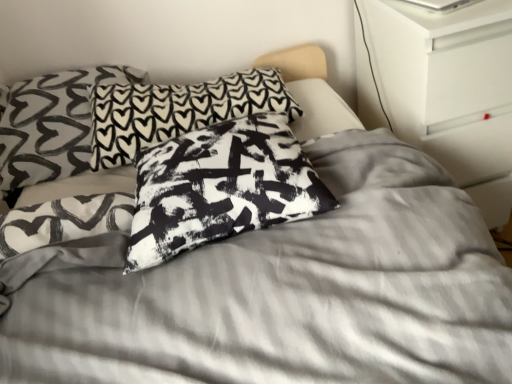
Question: Which direction should I rotate to look at black and white printed pillow at center, positioned as the 2th pillow in back-to-front order, — up or down?

Choices:
 (A) down
 (B) up

Answer: (B)

Question: From the image's perspective, is white glossy dresser at upper right on black-and-white printed pillow at center, the 1th pillow positioned from the front?

Choices:
 (A) no
 (B) yes

Answer: (B)

Question: Is white glossy dresser at upper right shorter than black-and-white printed pillow at center, the third pillow in the back-to-front sequence?

Choices:
 (A) yes
 (B) no

Answer: (B)

Question: From a real-world perspective, is white glossy dresser at upper right positioned under black-and-white printed pillow at center, the 1th pillow positioned from the front, based on gravity?

Choices:
 (A) yes
 (B) no

Answer: (A)

Question: Does white glossy dresser at upper right have a lesser width compared to black-and-white printed pillow at center, the 1th pillow positioned from the front?

Choices:
 (A) no
 (B) yes

Answer: (A)

Question: Is white glossy dresser at upper right positioned with its back to black-and-white printed pillow at center, the 1th pillow positioned from the front?

Choices:
 (A) yes
 (B) no

Answer: (B)

Question: Is white glossy dresser at upper right at the right side of black-and-white printed pillow at center, the third pillow in the back-to-front sequence?

Choices:
 (A) no
 (B) yes

Answer: (B)

Question: Is the depth of black printed pillow at center, placed as the 3th pillow when sorted from front to back, less than that of black and white printed pillow at center, acting as the second pillow starting from the front?

Choices:
 (A) no
 (B) yes

Answer: (A)

Question: Is black printed pillow at center, which is counted as the 1th pillow, starting from the back, bigger than black and white printed pillow at center, acting as the second pillow starting from the front?

Choices:
 (A) no
 (B) yes

Answer: (A)

Question: Considering the relative positions of black printed pillow at center, which is counted as the 1th pillow, starting from the back, and black and white printed pillow at center, acting as the second pillow starting from the front, in the image provided, is black printed pillow at center, which is counted as the 1th pillow, starting from the back, behind black and white printed pillow at center, acting as the second pillow starting from the front,?

Choices:
 (A) no
 (B) yes

Answer: (B)

Question: From a real-world perspective, is black printed pillow at center, placed as the 3th pillow when sorted from front to back, below black and white printed pillow at center, acting as the second pillow starting from the front?

Choices:
 (A) yes
 (B) no

Answer: (A)

Question: Considering the relative sizes of black printed pillow at center, placed as the 3th pillow when sorted from front to back, and black and white printed pillow at center, acting as the second pillow starting from the front, in the image provided, is black printed pillow at center, placed as the 3th pillow when sorted from front to back, shorter than black and white printed pillow at center, acting as the second pillow starting from the front,?

Choices:
 (A) yes
 (B) no

Answer: (A)

Question: Is black printed pillow at center, placed as the 3th pillow when sorted from front to back, taller than black and white printed pillow at center, positioned as the 2th pillow in back-to-front order?

Choices:
 (A) no
 (B) yes

Answer: (A)

Question: Considering the relative positions of black-and-white printed pillow at center, the 1th pillow positioned from the front, and black printed pillow at center, which is counted as the 1th pillow, starting from the back, in the image provided, is black-and-white printed pillow at center, the 1th pillow positioned from the front, behind black printed pillow at center, which is counted as the 1th pillow, starting from the back,?

Choices:
 (A) no
 (B) yes

Answer: (A)